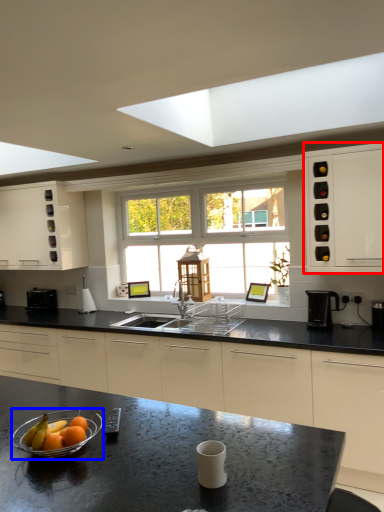
Question: Which point is closer to the camera, cabinetry (highlighted by a red box) or glass bowl (highlighted by a blue box)?

Choices:
 (A) cabinetry
 (B) glass bowl

Answer: (B)